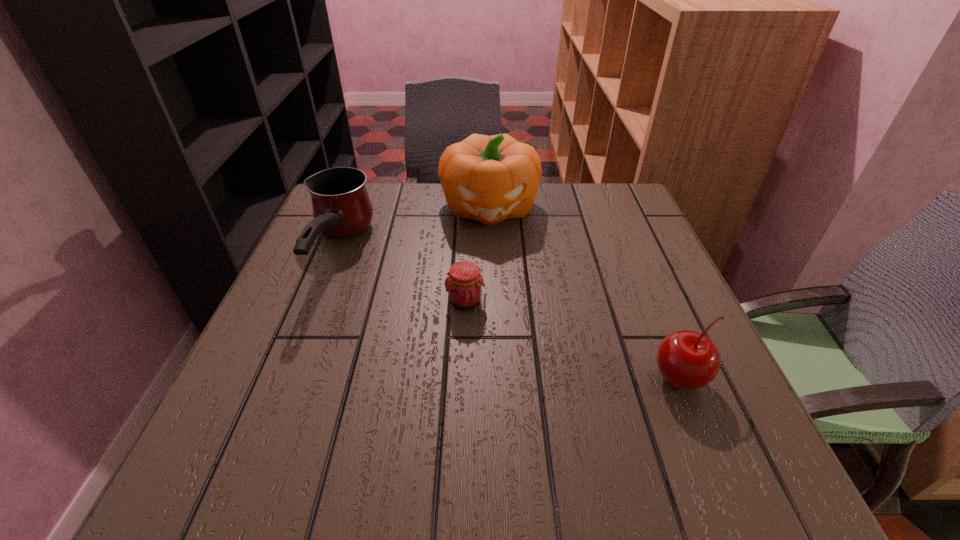
Locate an element on the screen. pumpkin is located at coordinates (490, 179).

The height and width of the screenshot is (540, 960). Identify the location of saucepan. (342, 208).

Where is `the third shortest object`? The image size is (960, 540). the third shortest object is located at coordinates (342, 208).

Where is `the third tallest object`? The width and height of the screenshot is (960, 540). the third tallest object is located at coordinates (688, 360).

Where is `the nearest object`? The width and height of the screenshot is (960, 540). the nearest object is located at coordinates (688, 360).

Where is `the shortest object`? the shortest object is located at coordinates 464,284.

The image size is (960, 540). Find the location of `blank space located on the carved face of the tallest object`. blank space located on the carved face of the tallest object is located at coordinates (492, 307).

Locate an element on the screen. This screenshot has width=960, height=540. free space located 0.170m on the handle side of the saucepan is located at coordinates 287,375.

The height and width of the screenshot is (540, 960). Find the location of `free space located on the back of the nearest object`. free space located on the back of the nearest object is located at coordinates (635, 267).

Locate an element on the screen. This screenshot has width=960, height=540. free space located 0.250m on the front of the shortest object is located at coordinates (461, 433).